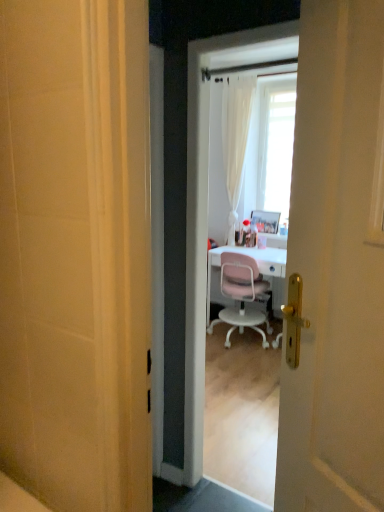
Identify the location of pink plastic chair at center. Image resolution: width=384 pixels, height=512 pixels. (241, 295).

What do you see at coordinates (241, 295) in the screenshot? I see `pink plastic chair at center` at bounding box center [241, 295].

Locate an element on the screen. The image size is (384, 512). metallic silver picture frame at center is located at coordinates (266, 221).

The width and height of the screenshot is (384, 512). What do you see at coordinates (266, 221) in the screenshot?
I see `metallic silver picture frame at center` at bounding box center [266, 221].

Image resolution: width=384 pixels, height=512 pixels. I want to click on pink plastic chair at center, so click(241, 295).

Is pink plastic chair at center to the left of metallic silver picture frame at center from the viewer's perspective?

Yes, pink plastic chair at center is to the left of metallic silver picture frame at center.

Is the position of pink plastic chair at center less distant than that of metallic silver picture frame at center?

Yes.

Does point (254, 259) appear closer or farther from the camera than point (266, 228)?

Point (254, 259) appears to be closer to the viewer than point (266, 228).

From the image's perspective, which object appears higher, pink plastic chair at center or metallic silver picture frame at center?

From the image's view, metallic silver picture frame at center is above.

From a real-world perspective, is pink plastic chair at center under metallic silver picture frame at center?

Yes, from a real-world perspective, pink plastic chair at center is below metallic silver picture frame at center.

Looking at their sizes, would you say pink plastic chair at center is wider or thinner than metallic silver picture frame at center?

Clearly, pink plastic chair at center has more width compared to metallic silver picture frame at center.

Considering the relative sizes of pink plastic chair at center and metallic silver picture frame at center in the image provided, is pink plastic chair at center taller than metallic silver picture frame at center?

Yes.

In terms of size, does pink plastic chair at center appear bigger or smaller than metallic silver picture frame at center?

Clearly, pink plastic chair at center is larger in size than metallic silver picture frame at center.

Would you say pink plastic chair at center contains metallic silver picture frame at center?

No, metallic silver picture frame at center is not inside pink plastic chair at center.

Can you see pink plastic chair at center touching metallic silver picture frame at center?

No.

Looking at this image, is pink plastic chair at center facing towards metallic silver picture frame at center?

Yes, pink plastic chair at center is aimed at metallic silver picture frame at center.

What's the angular difference between pink plastic chair at center and metallic silver picture frame at center's facing directions?

The facing directions of pink plastic chair at center and metallic silver picture frame at center are 177 degrees apart.

How distant is pink plastic chair at center from metallic silver picture frame at center?

pink plastic chair at center and metallic silver picture frame at center are 31.88 inches apart from each other.

What are the coordinates of `chair below the metallic silver picture frame at center (from a real-world perspective)` in the screenshot? It's located at (241, 295).

Considering the relative positions of metallic silver picture frame at center and pink plastic chair at center in the image provided, is metallic silver picture frame at center to the right of pink plastic chair at center from the viewer's perspective?

Yes.

In the scene shown: Who is more distant, metallic silver picture frame at center or pink plastic chair at center?

metallic silver picture frame at center is behind.

Which is behind, point (255, 218) or point (213, 323)?

The point (255, 218) is farther.

In the scene shown: From the image's perspective, is metallic silver picture frame at center positioned above or below pink plastic chair at center?

Based on their image positions, metallic silver picture frame at center is located above pink plastic chair at center.

From a real-world perspective, does metallic silver picture frame at center stand above pink plastic chair at center?

Indeed, from a real-world perspective, metallic silver picture frame at center stands above pink plastic chair at center.

Considering the sizes of metallic silver picture frame at center and pink plastic chair at center in the image, is metallic silver picture frame at center wider or thinner than pink plastic chair at center?

metallic silver picture frame at center is thinner than pink plastic chair at center.

In the scene shown: Considering the relative sizes of metallic silver picture frame at center and pink plastic chair at center in the image provided, is metallic silver picture frame at center taller than pink plastic chair at center?

No.

Is metallic silver picture frame at center smaller than pink plastic chair at center?

Indeed, metallic silver picture frame at center has a smaller size compared to pink plastic chair at center.

Is metallic silver picture frame at center situated inside pink plastic chair at center or outside?

metallic silver picture frame at center is outside pink plastic chair at center.

Is metallic silver picture frame at center placed right next to pink plastic chair at center?

No.

Could you tell me if metallic silver picture frame at center is facing pink plastic chair at center?

No, metallic silver picture frame at center does not turn towards pink plastic chair at center.

Can you tell me how much metallic silver picture frame at center and pink plastic chair at center differ in facing direction?

They differ by 177 degrees in their facing directions.

Where is `chair below the metallic silver picture frame at center (from a real-world perspective)`? The height and width of the screenshot is (512, 384). chair below the metallic silver picture frame at center (from a real-world perspective) is located at coordinates (241, 295).

The image size is (384, 512). In the image, there is a metallic silver picture frame at center. In order to click on chair below it (from the image's perspective) in this screenshot , I will do `click(241, 295)`.

Where is `picture frame behind the pink plastic chair at center`? picture frame behind the pink plastic chair at center is located at coordinates (266, 221).